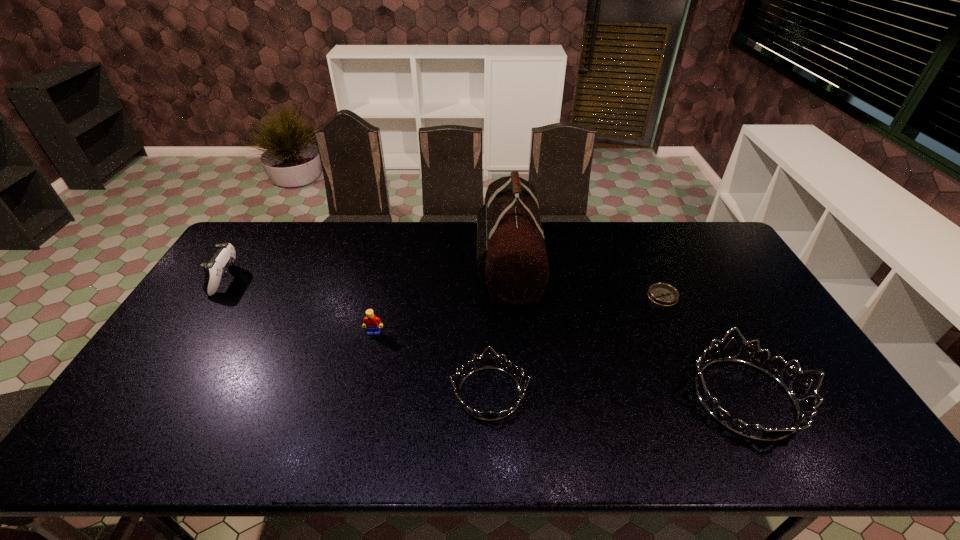
Identify the location of free space that satisfies the following two spatial constraints: 1. on the front pocket of the tallest object; 2. on the face of the fifth object from right to left. Image resolution: width=960 pixels, height=540 pixels. (514, 333).

At what (x,y) coordinates should I click in order to perform the action: click on vacant point that satisfies the following two spatial constraints: 1. on the front pocket of the tallest object; 2. on the face of the third nearest object. Please return your answer as a coordinate pair (x, y). The width and height of the screenshot is (960, 540). Looking at the image, I should click on (514, 333).